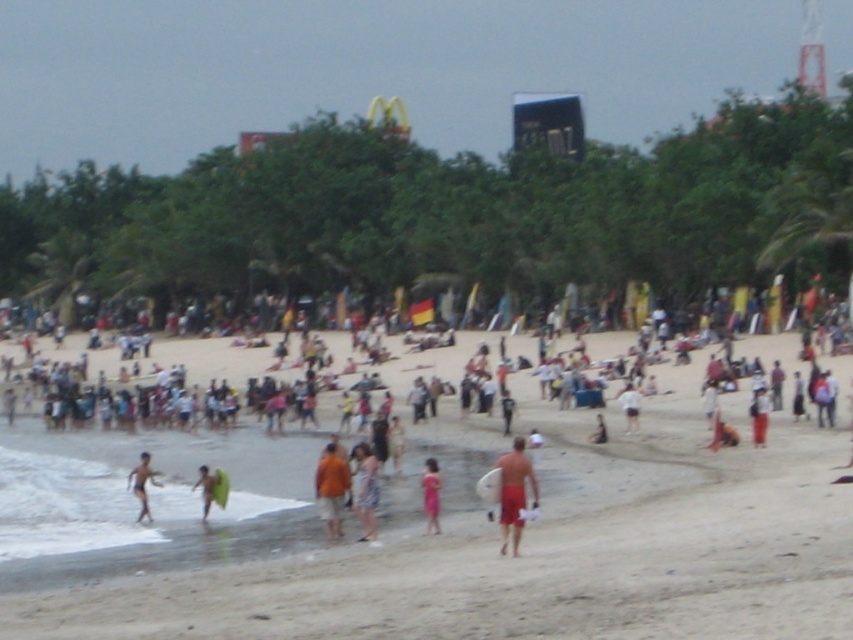
You are a photographer trying to capture a photo of the red matte surfboard at center and the matte red shorts at lower right. Since you want both objects to appear equally prominent in the photo, which object should you move closer to?

The red matte surfboard at center is larger than the matte red shorts at lower right. To make both appear equally prominent in the photo, you should move closer to the red matte surfboard at center so that its larger size is reduced in the frame, balancing it with the smaller matte red shorts at lower right.